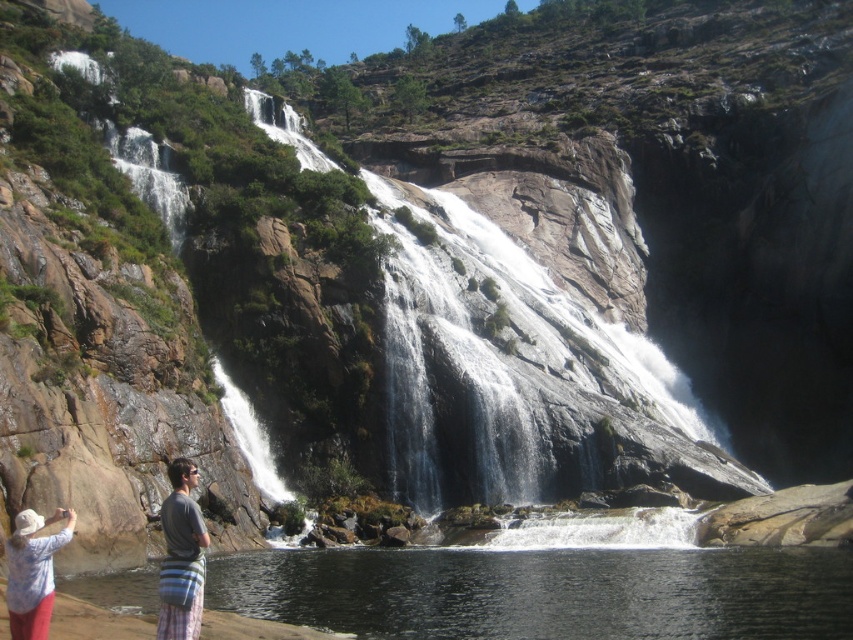
In the scene shown: You are a photographer trying to capture the white cotton hat at lower left and the clear water at lower left in the same frame. Based on their positions, which object is closer to you as you take the photo?

The clear water at lower left is closer to you than the white cotton hat at lower left because it is further to the viewer, meaning it appears nearer in the frame.

Based on the photo, you are planning to place a small plant between the gray striped bag at lower left and the white cotton hat at lower left. Which object should the plant be closer to if it needs to be placed at the same height as the taller object?

The gray striped bag at lower left is taller than the white cotton hat at lower left. Therefore, the plant should be placed closer to the gray striped bag at lower left to match its height.

You are hiking near the waterfall and want to place your gray striped bag at lower left on the ground next to the clear water at lower left. Based on the scene, will the bag be visible above the water level?

The clear water at lower left is shorter than gray striped bag at lower left, so yes, the gray striped bag at lower left will be visible above the water level.